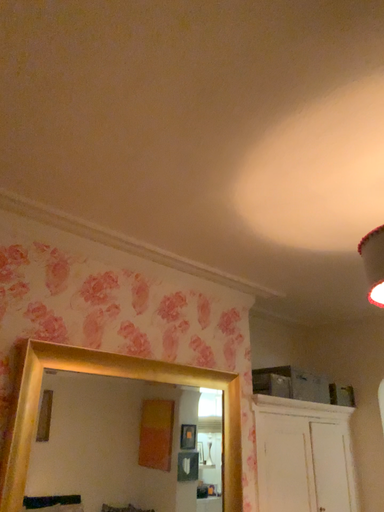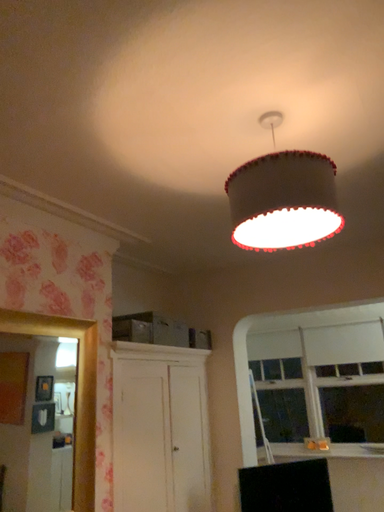
Question: Which way did the camera rotate in the video?

Choices:
 (A) rotated upward
 (B) rotated downward

Answer: (B)